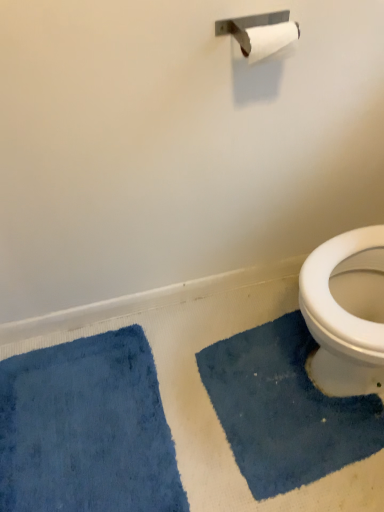
This screenshot has height=512, width=384. What are the coordinates of `free space underneath blue plush bath mat at lower right, arranged as the first bath mat when viewed from the right (from a real-world perspective)` in the screenshot? It's located at (263, 419).